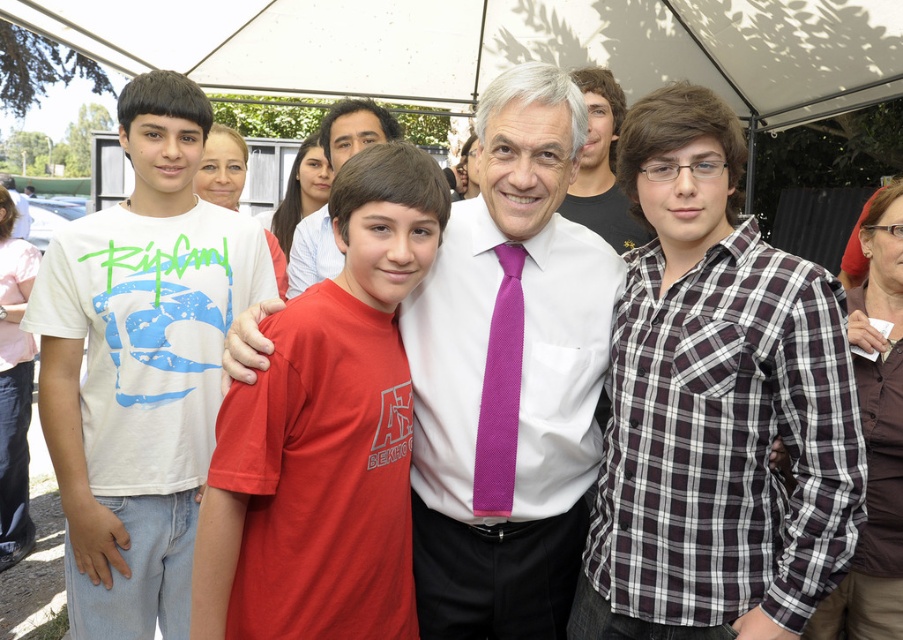
From the picture: Who is higher up, white fabric canopy at upper center or purple textured tie at center?

white fabric canopy at upper center

Between point (523, 28) and point (481, 477), which one is positioned behind?

The point (523, 28) is more distant.

Find the location of a particular element. white fabric canopy at upper center is located at coordinates (497, 45).

Who is lower down, white smooth shirt at center or white fabric canopy at upper center?

white smooth shirt at center is below.

Is point (486, 179) less distant than point (70, 20)?

Yes, it is.

Identify the location of white smooth shirt at center. (508, 376).

Locate an element on the screen. The image size is (903, 640). white smooth shirt at center is located at coordinates (508, 376).

Is point (468, 374) positioned before point (489, 428)?

No.

Does point (490, 131) come behind point (494, 433)?

No, (490, 131) is closer to viewer.

What are the coordinates of `white smooth shirt at center` in the screenshot? It's located at (508, 376).